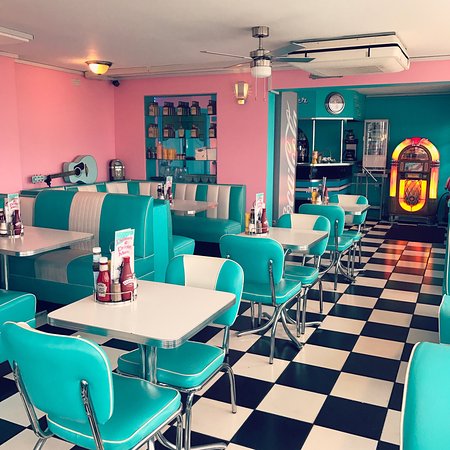
Where is `light fixture`? Image resolution: width=450 pixels, height=450 pixels. light fixture is located at coordinates (94, 68), (257, 71).